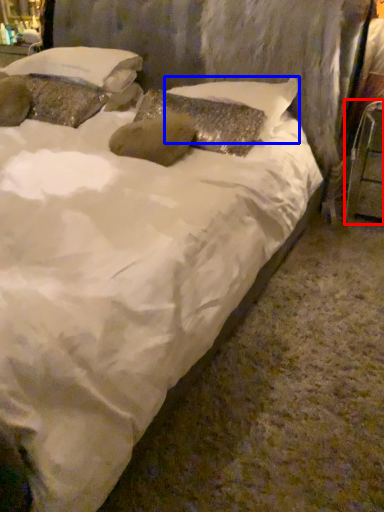
Question: Which of the following is the farthest to the observer, furniture (highlighted by a red box) or pillow (highlighted by a blue box)?

Choices:
 (A) furniture
 (B) pillow

Answer: (A)